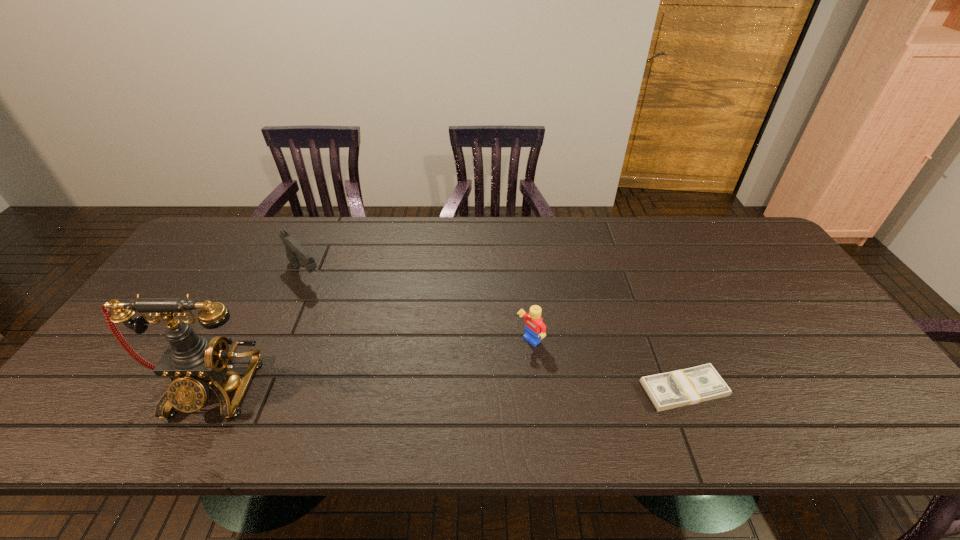
Find the location of a particular element. The image size is (960, 540). the tallest object is located at coordinates (193, 362).

Image resolution: width=960 pixels, height=540 pixels. I want to click on dollar, so (x=689, y=386).

Where is `the shortest object`? Image resolution: width=960 pixels, height=540 pixels. the shortest object is located at coordinates (689, 386).

Locate an element on the screen. pistol is located at coordinates (294, 251).

Locate an element on the screen. Image resolution: width=960 pixels, height=540 pixels. the third nearest object is located at coordinates (535, 329).

Image resolution: width=960 pixels, height=540 pixels. What are the coordinates of `the second object from right to left` in the screenshot? It's located at (535, 329).

The height and width of the screenshot is (540, 960). Identify the location of free region located 0.180m on the right of the dollar. (804, 389).

Locate an element on the screen. This screenshot has width=960, height=540. free location located 0.180m at the barrel of the farthest object is located at coordinates (348, 320).

Identify the location of vacant space located 0.230m at the barrel of the farthest object. This screenshot has height=540, width=960. point(358,330).

Where is `vacant space located at the barrel of the farthest object`? vacant space located at the barrel of the farthest object is located at coordinates (341, 312).